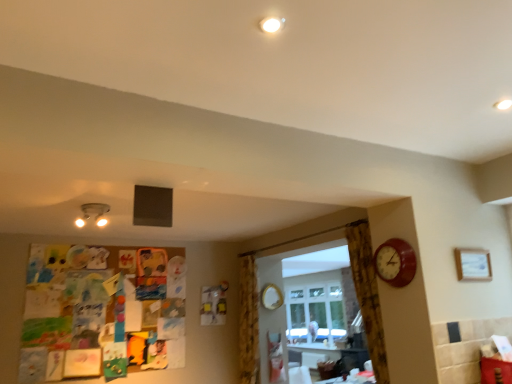
Question: Which is correct: matte white lamp at upper left is inside wooden clock at right, or outside of it?

Choices:
 (A) inside
 (B) outside

Answer: (B)

Question: From a real-world perspective, is matte white lamp at upper left positioned above or below wooden clock at right?

Choices:
 (A) above
 (B) below

Answer: (A)

Question: Which object is positioned farthest from the matte white lamp at upper left?

Choices:
 (A) brown textured curtain at right, the second curtain when ordered from back to front
 (B) gold metallic mirror at center
 (C) yellow floral fabric curtain at center, which is the 2th curtain in right-to-left order
 (D) wooden clock at right
 (E) wooden picture frame at upper right

Answer: (E)

Question: Based on their relative distances, which object is nearer to the wooden clock at right?

Choices:
 (A) yellow floral fabric curtain at center, arranged as the first curtain when viewed from the back
 (B) wooden picture frame at upper right
 (C) gold metallic mirror at center
 (D) brown textured curtain at right, the first curtain positioned from the front
 (E) matte white lamp at upper left

Answer: (B)